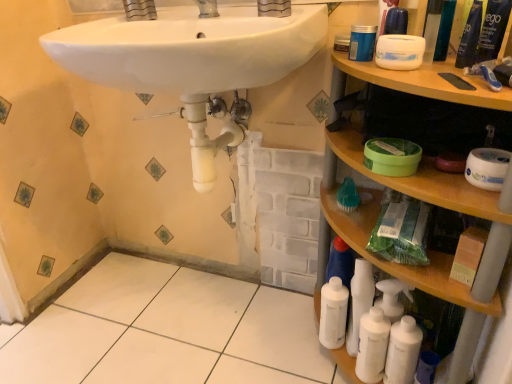
At what (x,y) coordinates should I click in order to perform the action: click on free spot in front of blue plastic container at upper right, which appears as the 4th mouthwash when viewed from the top. Please return your answer as a coordinate pair (x, y). This screenshot has height=384, width=512. Looking at the image, I should click on (409, 75).